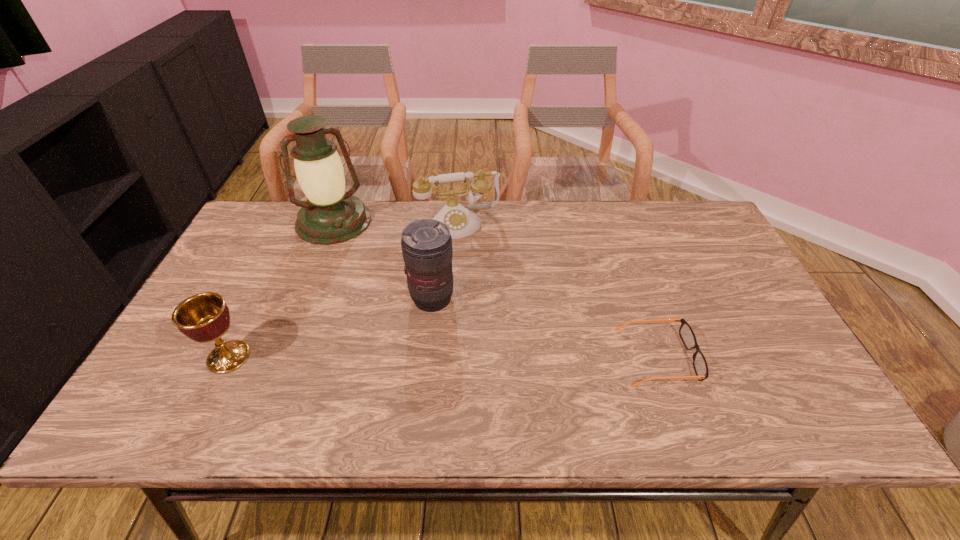
This screenshot has height=540, width=960. Identify the location of free region at the far right corner. (686, 204).

This screenshot has height=540, width=960. In order to click on free space between the tallest object and the spectacles in this screenshot , I will do `click(496, 289)`.

Where is `free spot between the chalice and the tallest object`? free spot between the chalice and the tallest object is located at coordinates (281, 289).

This screenshot has width=960, height=540. Find the location of `vacant region between the telephone and the lantern`. vacant region between the telephone and the lantern is located at coordinates pos(396,222).

Locate an element on the screen. The image size is (960, 540). unoccupied area between the second tallest object and the rightmost object is located at coordinates (545, 328).

The height and width of the screenshot is (540, 960). In order to click on free spot between the tallest object and the chalice in this screenshot , I will do pos(281,289).

The height and width of the screenshot is (540, 960). Find the location of `free space between the spectacles and the telephone`. free space between the spectacles and the telephone is located at coordinates (558, 290).

In order to click on free space between the telephoto lens and the tallest object in this screenshot , I will do `click(383, 260)`.

What are the coordinates of `free space that is in between the lantern and the chalice` in the screenshot? It's located at (281, 289).

You are a GUI agent. You are given a task and a screenshot of the screen. Output one action in this format:
    pyautogui.click(x=<x>, y=<y>)
    Task: Click on the free spot between the shortest object and the telephone
    
    Given the screenshot: What is the action you would take?
    pyautogui.click(x=558, y=290)